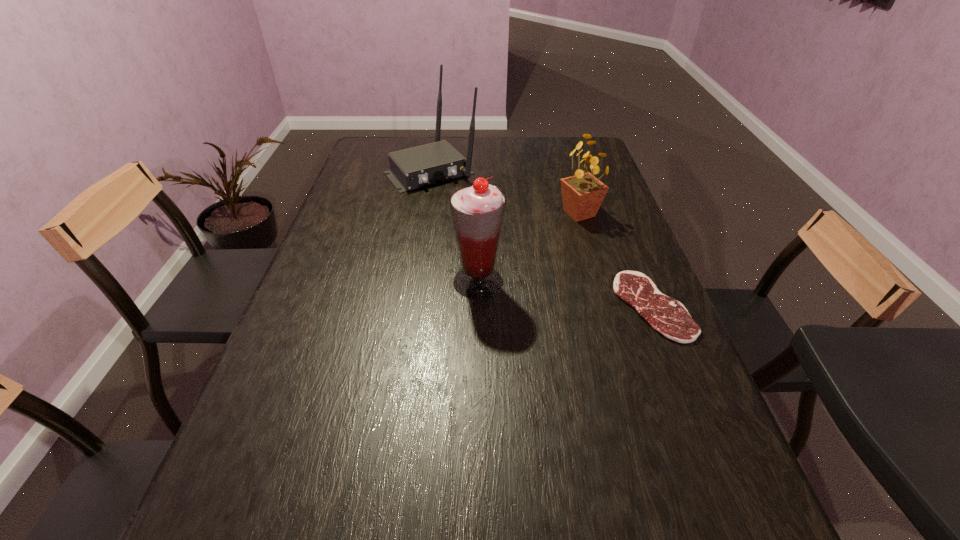
You are a GUI agent. You are given a task and a screenshot of the screen. Output one action in this format:
    pyautogui.click(x=<x>, y=<y>)
    Task: Click on the smoothie
    
    Given the screenshot: What is the action you would take?
    pyautogui.click(x=477, y=209)

Identify the location of steak. (668, 316).

Find the location of `the farthest object`. the farthest object is located at coordinates (416, 167).

This screenshot has height=540, width=960. I want to click on the third tallest object, so click(582, 194).

This screenshot has width=960, height=540. Find the location of `sunflower`. sunflower is located at coordinates (582, 194).

Where is `vacant space situated on the front of the smoothie`? vacant space situated on the front of the smoothie is located at coordinates (478, 347).

The image size is (960, 540). In order to click on vacant space located on the back of the steak in this screenshot , I will do `click(619, 224)`.

Find the location of a particular element. Image resolution: width=960 pixels, height=540 pixels. free space located on the back of the farthest object to connect cables is located at coordinates (474, 214).

The image size is (960, 540). In order to click on free location located on the back of the farthest object to connect cables in this screenshot , I will do `click(460, 199)`.

Identify the location of vacant point located 0.390m on the back of the farthest object to connect cables. (513, 255).